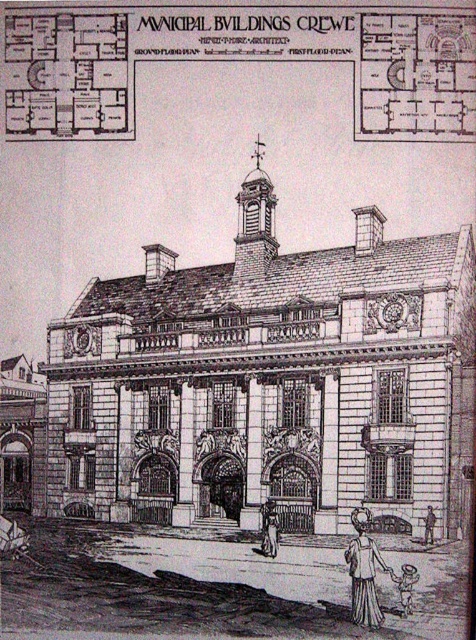
Can you confirm if smooth gray statue at center is wider than brown paper bag at lower right?

Correct, the width of smooth gray statue at center exceeds that of brown paper bag at lower right.

Between smooth gray statue at center and brown paper bag at lower right, which one has more height?

smooth gray statue at center

Locate an element on the screen. Image resolution: width=476 pixels, height=640 pixels. smooth gray statue at center is located at coordinates point(269,529).

Who is positioned more to the right, stone textured church at center or smooth gray statue at center?

Positioned to the right is smooth gray statue at center.

Does point (385, 348) come farther from viewer compared to point (269, 552)?

That is True.

At what (x,y) coordinates should I click in order to perform the action: click on stone textured church at center. Please return your answer as a coordinate pair (x, y). This screenshot has height=640, width=476. Looking at the image, I should click on (267, 381).

In the scene shown: Between brown paper bag at lower right and smooth skin person at lower right, which one has more height?

With more height is smooth skin person at lower right.

Does brown paper bag at lower right have a greater height compared to smooth skin person at lower right?

No, brown paper bag at lower right is not taller than smooth skin person at lower right.

Describe the element at coordinates (406, 586) in the screenshot. I see `brown paper bag at lower right` at that location.

Find the location of a particular element. The height and width of the screenshot is (640, 476). brown paper bag at lower right is located at coordinates (406, 586).